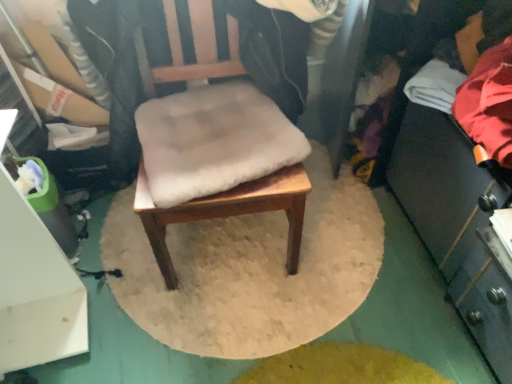
Find the location of a particular element. vacant space underneath wooden chair at center (from a real-world perspective) is located at coordinates (234, 250).